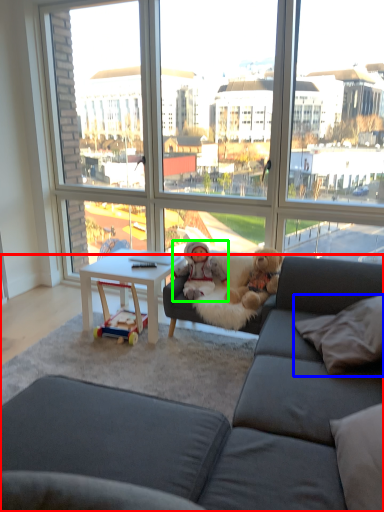
Question: Estimate the real-world distances between objects in this image. Which object is closer to studio couch (highlighted by a red box), pillow (highlighted by a blue box) or person (highlighted by a green box)?

Choices:
 (A) pillow
 (B) person

Answer: (A)